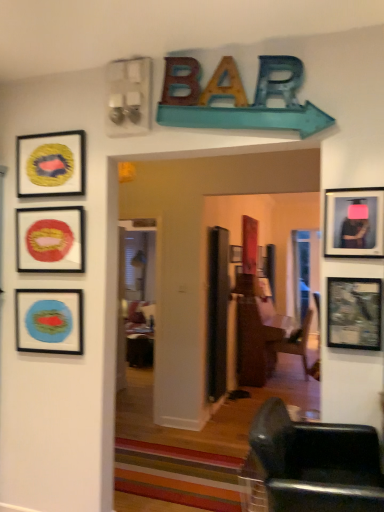
Question: Is matte red circular object at upper left, which is the 4th picture frame from back to front, oriented towards brown wooden door at center?

Choices:
 (A) no
 (B) yes

Answer: (A)

Question: Considering the relative sizes of matte red circular object at upper left, which is the 5th picture frame in right-to-left order, and brown wooden door at center in the image provided, is matte red circular object at upper left, which is the 5th picture frame in right-to-left order, smaller than brown wooden door at center?

Choices:
 (A) yes
 (B) no

Answer: (A)

Question: Considering the relative sizes of matte red circular object at upper left, which is the 5th picture frame in right-to-left order, and brown wooden door at center in the image provided, is matte red circular object at upper left, which is the 5th picture frame in right-to-left order, bigger than brown wooden door at center?

Choices:
 (A) yes
 (B) no

Answer: (B)

Question: Does matte red circular object at upper left, which is the 5th picture frame in right-to-left order, contain brown wooden door at center?

Choices:
 (A) no
 (B) yes

Answer: (A)

Question: From a real-world perspective, does matte red circular object at upper left, arranged as the 3th picture frame when viewed from the front, stand above brown wooden door at center?

Choices:
 (A) yes
 (B) no

Answer: (A)

Question: Is matte red circular object at upper left, the 2th picture frame in the left-to-right sequence, further to camera compared to brown wooden door at center?

Choices:
 (A) yes
 (B) no

Answer: (B)

Question: Is metallic silver television at right, which appears as the 6th picture frame when viewed from the left, to the left of matte blue picture frame at left, which appears as the third picture frame when viewed from the back, from the viewer's perspective?

Choices:
 (A) no
 (B) yes

Answer: (A)

Question: Does metallic silver television at right, which is counted as the 6th picture frame, starting from the back, have a smaller size compared to matte blue picture frame at left, which appears as the third picture frame when viewed from the back?

Choices:
 (A) no
 (B) yes

Answer: (B)

Question: Can you confirm if metallic silver television at right, the 1th picture frame when ordered from right to left, is shorter than matte blue picture frame at left, arranged as the first picture frame when viewed from the left?

Choices:
 (A) no
 (B) yes

Answer: (B)

Question: From the image's perspective, does metallic silver television at right, the 1th picture frame in the front-to-back sequence, appear higher than matte blue picture frame at left, arranged as the first picture frame when viewed from the left?

Choices:
 (A) no
 (B) yes

Answer: (B)

Question: From a real-world perspective, does metallic silver television at right, which appears as the 6th picture frame when viewed from the left, sit lower than matte blue picture frame at left, arranged as the first picture frame when viewed from the left?

Choices:
 (A) yes
 (B) no

Answer: (B)

Question: Is matte blue picture frame at left, positioned as the sixth picture frame in right-to-left order, at the back of metallic silver television at right, the 1th picture frame when ordered from right to left?

Choices:
 (A) yes
 (B) no

Answer: (B)

Question: Does wooden striped rug at center have a greater width compared to matte black picture frame at center, which is counted as the sixth picture frame, starting from the front?

Choices:
 (A) no
 (B) yes

Answer: (B)